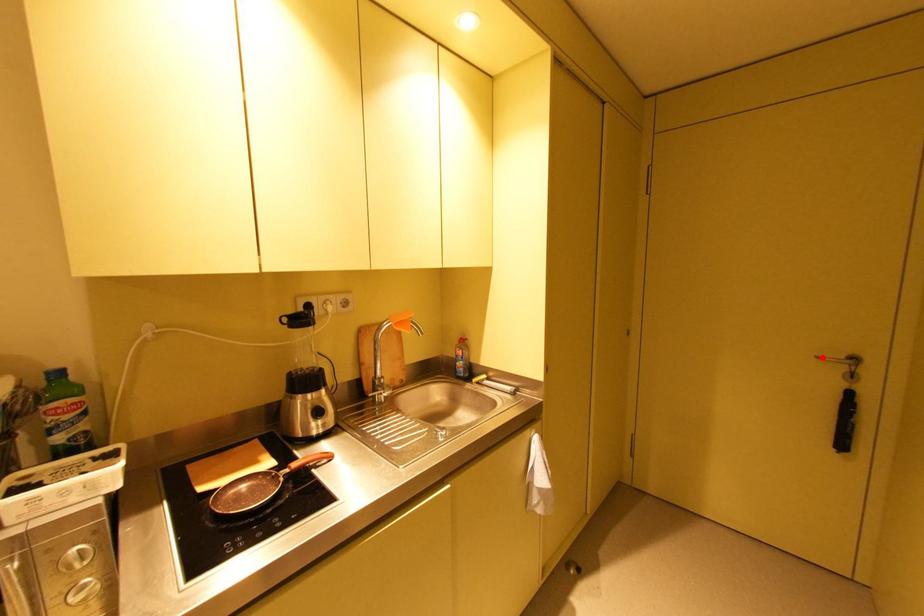
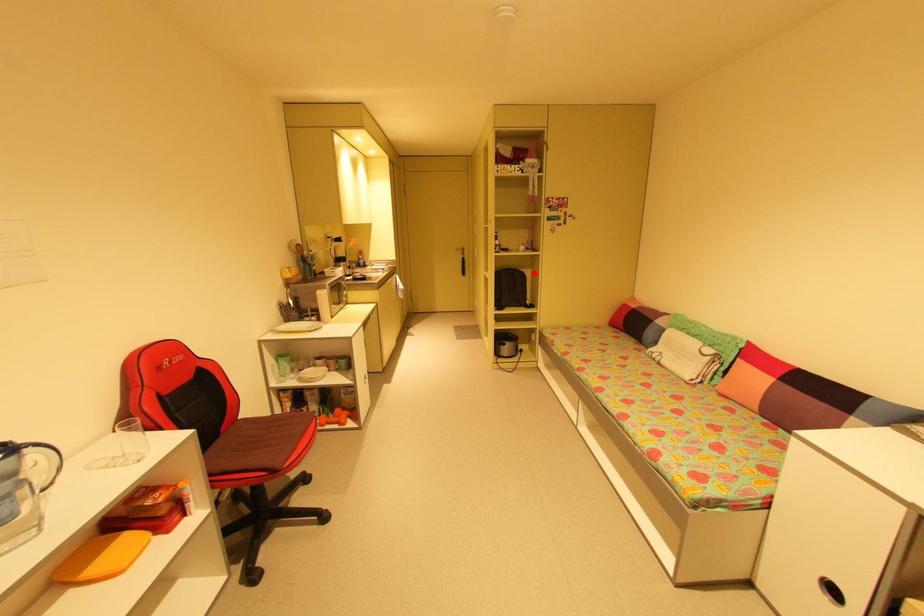
I am providing you with two images of the same scene from different viewpoints. A red point is marked on the first image and another point is marked on the second image. Does the point marked in image1 correspond to the same location as the one in image2?

No